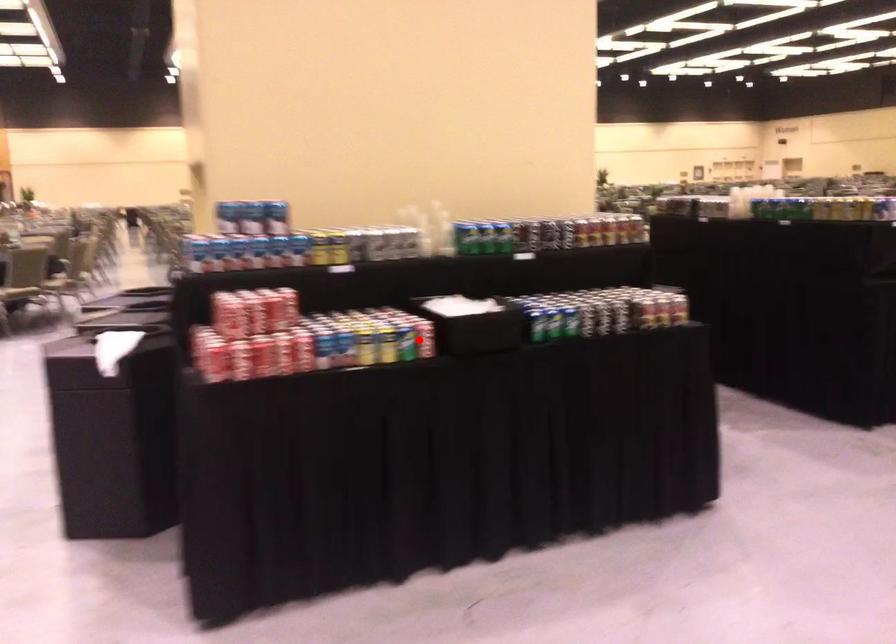
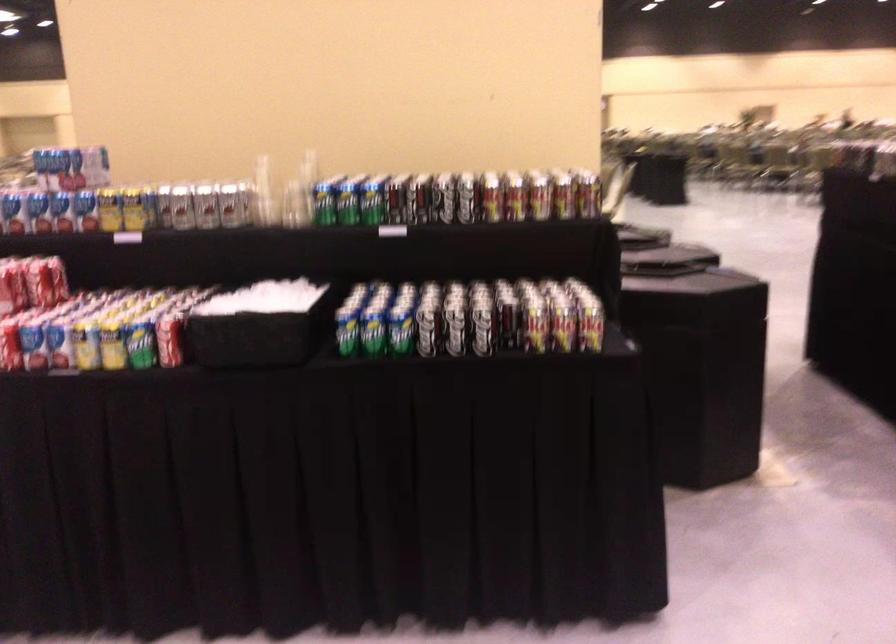
In the second image, find the point that corresponds to the highlighted location in the first image.

(169, 339)